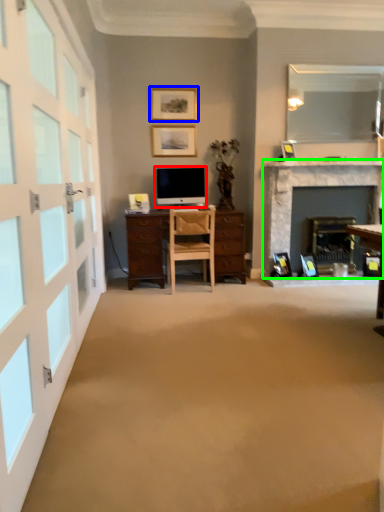
Question: Which object is the farthest from television (highlighted by a red box)? Choose among these: picture frame (highlighted by a blue box) or fireplace (highlighted by a green box).

Choices:
 (A) picture frame
 (B) fireplace

Answer: (B)